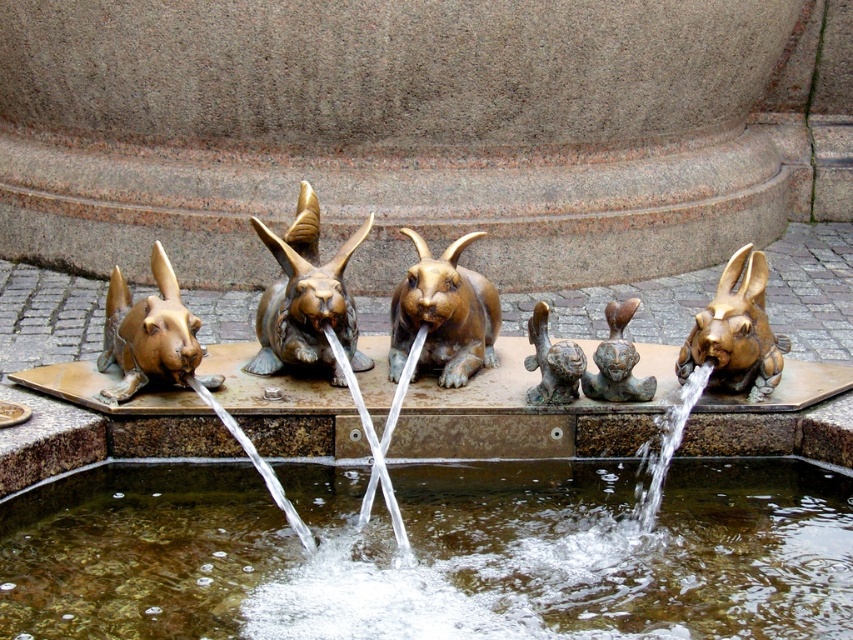
Looking at this image, you are standing in front of the fountain and want to take a photo of the gold metallic rabbit at left. If your camera has a maximum focus distance of 6 meters, will it be able to capture the rabbit clearly?

The gold metallic rabbit at left and camera are 6.38 meters apart. Since the distance exceeds the camera maximum focus distance of 6 meters, the camera cannot capture the rabbit clearly.